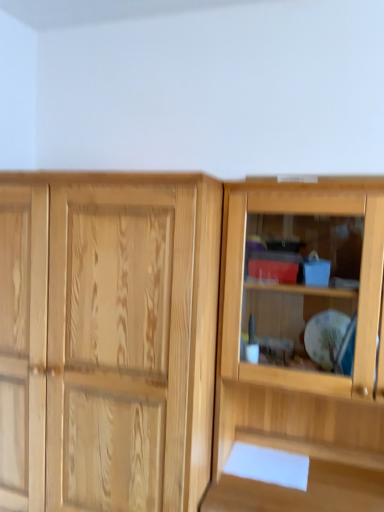
What do you see at coordinates (131, 342) in the screenshot? Image resolution: width=384 pixels, height=512 pixels. I see `natural wood cabinet at left` at bounding box center [131, 342].

This screenshot has height=512, width=384. In order to click on natural wood cabinet at left in this screenshot , I will do `click(131, 342)`.

What is the approximate height of natural wood cabinet at left?

natural wood cabinet at left is 5.36 feet tall.

Measure the distance between point (332,262) and camera.

The distance of point (332,262) from camera is 1.60 meters.

Find the location of a particular element. natural wood cupboard at right is located at coordinates (302, 345).

What do you see at coordinates (302, 345) in the screenshot? I see `natural wood cupboard at right` at bounding box center [302, 345].

Where is `natural wood cabinet at left`? natural wood cabinet at left is located at coordinates (131, 342).

Is natural wood cabinet at left at the left side of natural wood cupboard at right?

Indeed, natural wood cabinet at left is positioned on the left side of natural wood cupboard at right.

Is natural wood cabinet at left in front of natural wood cupboard at right?

No, natural wood cabinet at left is behind natural wood cupboard at right.

Consider the image. Which is closer, [178,295] or [289,449]?

Point [178,295] is positioned closer to the camera compared to point [289,449].

In the scene shown: From the image's perspective, which one is positioned lower, natural wood cabinet at left or natural wood cupboard at right?

natural wood cabinet at left appears lower in the image.

From a real-world perspective, is natural wood cabinet at left located beneath natural wood cupboard at right?

Yes, from a real-world perspective, natural wood cabinet at left is under natural wood cupboard at right.

Does natural wood cabinet at left have a lesser width compared to natural wood cupboard at right?

No.

In terms of height, does natural wood cabinet at left look taller or shorter compared to natural wood cupboard at right?

Considering their sizes, natural wood cabinet at left has more height than natural wood cupboard at right.

Based on their sizes in the image, would you say natural wood cabinet at left is bigger or smaller than natural wood cupboard at right?

natural wood cabinet at left is bigger than natural wood cupboard at right.

Is natural wood cupboard at right located within natural wood cabinet at left?

No, natural wood cupboard at right is not a part of natural wood cabinet at left.

Is natural wood cabinet at left placed right next to natural wood cupboard at right?

No, natural wood cabinet at left is not next to natural wood cupboard at right.

Is natural wood cabinet at left positioned with its back to natural wood cupboard at right?

No, natural wood cabinet at left is not facing away from natural wood cupboard at right.

Can you tell me how much natural wood cabinet at left and natural wood cupboard at right differ in facing direction?

The facing directions of natural wood cabinet at left and natural wood cupboard at right are 8.01e-05 degrees apart.

How much distance is there between natural wood cabinet at left and natural wood cupboard at right?

natural wood cabinet at left and natural wood cupboard at right are 16.73 inches apart.

This screenshot has width=384, height=512. There is a natural wood cabinet at left. In order to click on cupboard above it (from a real-world perspective) in this screenshot , I will do `click(302, 345)`.

Is natural wood cupboard at right to the right of natural wood cabinet at left from the viewer's perspective?

Indeed, natural wood cupboard at right is positioned on the right side of natural wood cabinet at left.

Looking at this image, considering the relative positions of natural wood cupboard at right and natural wood cabinet at left in the image provided, is natural wood cupboard at right in front of natural wood cabinet at left?

That is True.

Is point (361, 473) closer or farther from the camera than point (113, 200)?

Clearly, point (361, 473) is more distant from the camera than point (113, 200).

From the image's perspective, which is above, natural wood cupboard at right or natural wood cabinet at left?

natural wood cupboard at right, from the image's perspective.

From a real-world perspective, is natural wood cupboard at right located beneath natural wood cabinet at left?

No, from a real-world perspective, natural wood cupboard at right is not beneath natural wood cabinet at left.

Considering the relative sizes of natural wood cupboard at right and natural wood cabinet at left in the image provided, is natural wood cupboard at right thinner than natural wood cabinet at left?

Correct, the width of natural wood cupboard at right is less than that of natural wood cabinet at left.

Considering the sizes of objects natural wood cupboard at right and natural wood cabinet at left in the image provided, who is taller, natural wood cupboard at right or natural wood cabinet at left?

Standing taller between the two is natural wood cabinet at left.

Who is smaller, natural wood cupboard at right or natural wood cabinet at left?

Smaller between the two is natural wood cupboard at right.

Would you say natural wood cupboard at right is inside or outside natural wood cabinet at left?

natural wood cupboard at right lies outside natural wood cabinet at left.

Are natural wood cupboard at right and natural wood cabinet at left beside each other?

natural wood cupboard at right and natural wood cabinet at left are clearly separated.

Could you tell me if natural wood cupboard at right is turned towards natural wood cabinet at left?

No, natural wood cupboard at right is not aimed at natural wood cabinet at left.

Find the location of a particular element. This screenshot has width=384, height=512. cupboard that is on the right side of natural wood cabinet at left is located at coordinates (302, 345).

This screenshot has width=384, height=512. In order to click on screen door below the natural wood cupboard at right (from the image's perspective) in this screenshot , I will do coord(131,342).

Where is `screen door on the left of natural wood cupboard at right`? The image size is (384, 512). screen door on the left of natural wood cupboard at right is located at coordinates (131, 342).